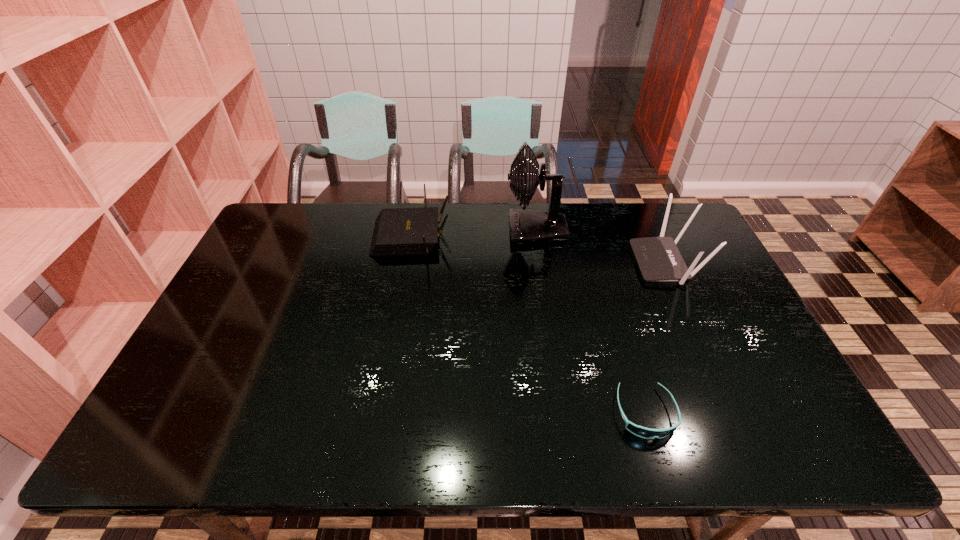
In order to click on vacant space located in front of the fan to blow air in this screenshot , I will do `click(398, 230)`.

Image resolution: width=960 pixels, height=540 pixels. Identify the location of vacant region located on the front-facing side of the rightmost object. (604, 263).

This screenshot has width=960, height=540. In order to click on vacant region located 0.150m on the front-facing side of the rightmost object in this screenshot , I will do `click(588, 263)`.

Where is `free space located 0.130m on the front-facing side of the rightmost object`? free space located 0.130m on the front-facing side of the rightmost object is located at coordinates (594, 263).

The width and height of the screenshot is (960, 540). What are the coordinates of `vacant region located on the left of the leftmost object` in the screenshot? It's located at (286, 236).

At what (x,y) coordinates should I click in order to perform the action: click on fan that is at the far edge. Please return your answer as a coordinate pair (x, y). This screenshot has height=540, width=960. Looking at the image, I should click on (526, 226).

What are the coordinates of `object present at the near edge` in the screenshot? It's located at (643, 432).

Find the location of a particular element. This screenshot has width=960, height=540. object that is at the right edge is located at coordinates (658, 258).

The image size is (960, 540). I want to click on object that is at the far right corner, so click(658, 258).

You are a GUI agent. You are given a task and a screenshot of the screen. Output one action in this format:
    pyautogui.click(x=<x>, y=<y>)
    Task: Click on the vacant space at the far edge of the desktop
    
    Given the screenshot: What is the action you would take?
    (637, 230)